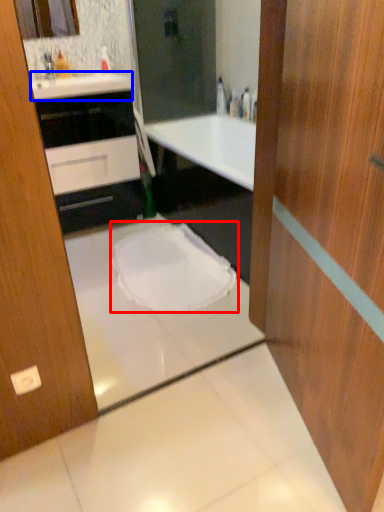
Question: Which of the following is the closest to the observer, toilet (highlighted by a red box) or counter top (highlighted by a blue box)?

Choices:
 (A) toilet
 (B) counter top

Answer: (A)